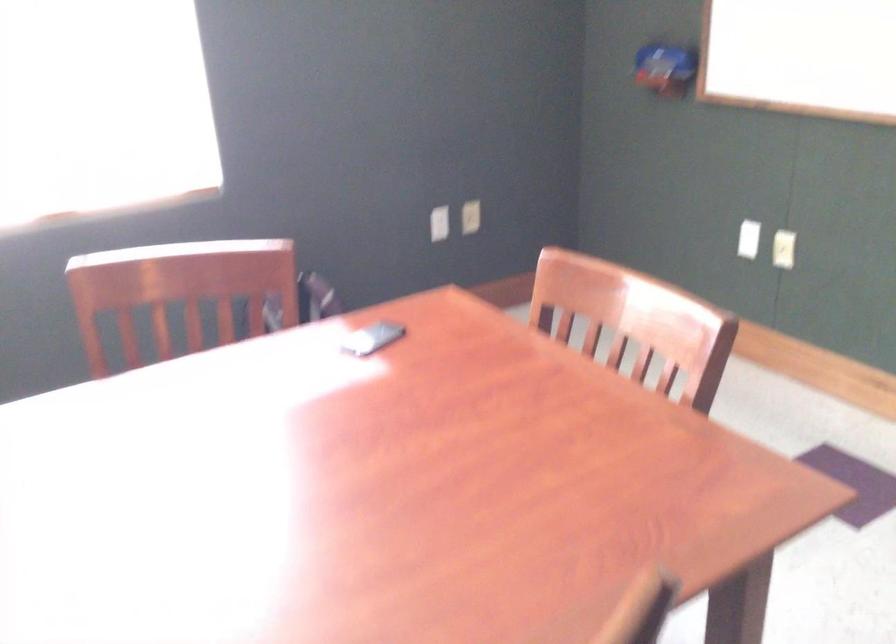
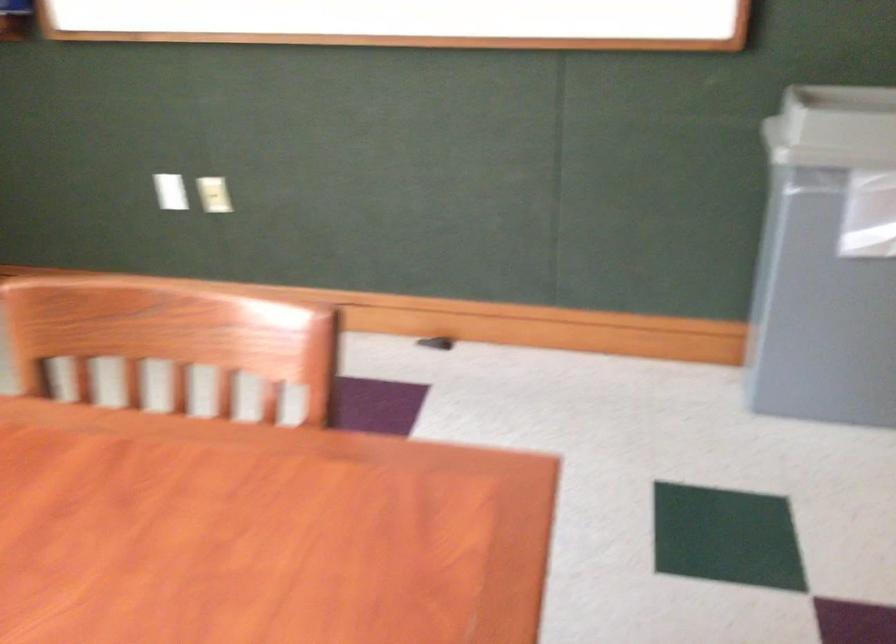
Question: The first image is from the beginning of the video and the second image is from the end. How did the camera likely rotate when shooting the video?

Choices:
 (A) Left
 (B) Right
 (C) Up
 (D) Down

Answer: (B)